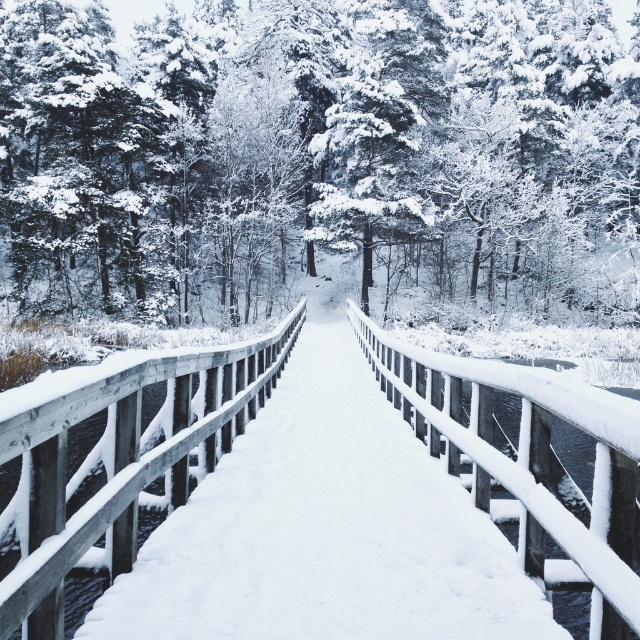
Is white wooden bridge at center further to the viewer compared to white wooden rail at left?

That is False.

Between point (625, 497) and point (20, 429), which one is positioned behind?

The point (625, 497) is more distant.

Locate an element on the screen. The image size is (640, 640). white wooden bridge at center is located at coordinates (115, 460).

Is point (604, 8) positioned after point (65, 536)?

Yes.

This screenshot has height=640, width=640. Identify the location of white snow-covered tree at center. (316, 152).

You are a GUI agent. You are given a task and a screenshot of the screen. Output one action in this format:
    pyautogui.click(x=<x>, y=<y>)
    Task: Click on the white snow-covered tree at center
    This screenshot has width=640, height=640.
    Given the screenshot: What is the action you would take?
    pyautogui.click(x=316, y=152)

Based on the photo, who is higher up, white snow-covered tree at center or white wooden bridge at center?

white snow-covered tree at center

Between white snow-covered tree at center and white wooden bridge at center, which one appears on the left side from the viewer's perspective?

white wooden bridge at center

Is point (506, 252) positioned before point (115, 454)?

No.

The height and width of the screenshot is (640, 640). What are the coordinates of `white snow-covered tree at center` in the screenshot? It's located at (316, 152).